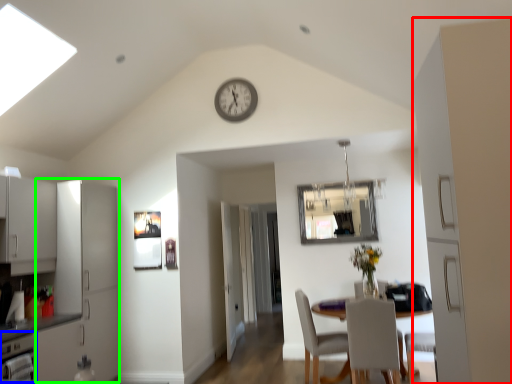
Question: Which object is the farthest from side (highlighted by a red box)? Choose among these: dish washer (highlighted by a blue box) or cabinetry (highlighted by a green box).

Choices:
 (A) dish washer
 (B) cabinetry

Answer: (B)